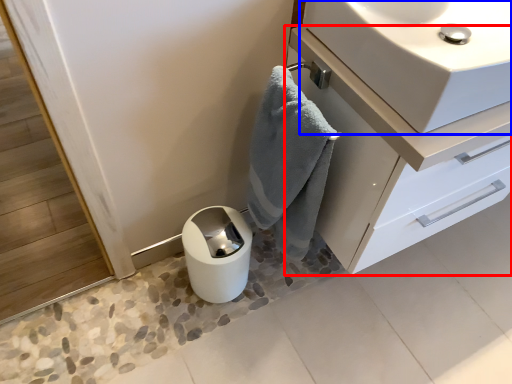
Question: Which of the following is the closest to the observer, bathroom cabinet (highlighted by a red box) or sink (highlighted by a blue box)?

Choices:
 (A) bathroom cabinet
 (B) sink

Answer: (B)